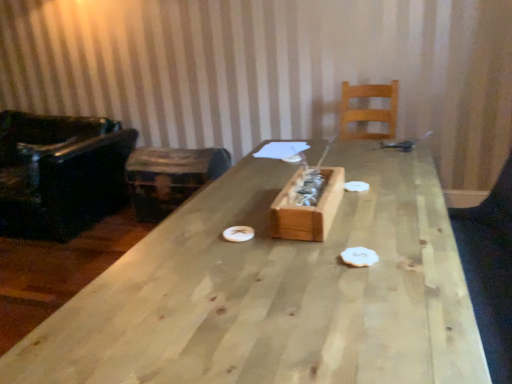
Question: From the image's perspective, is white matte paper plate at center, acting as the second paper plate starting from the left, on light wood chair at upper right, which is counted as the 1th chair, starting from the right?

Choices:
 (A) yes
 (B) no

Answer: (B)

Question: Is white matte paper plate at center, which ranks as the 1th paper plate in back-to-front order, further to the viewer compared to light wood chair at upper right, the second chair positioned from the left?

Choices:
 (A) yes
 (B) no

Answer: (B)

Question: Is white matte paper plate at center, marked as the first paper plate in a top-to-bottom arrangement, to the left of light wood chair at upper right, which is counted as the 1th chair, starting from the right, from the viewer's perspective?

Choices:
 (A) yes
 (B) no

Answer: (A)

Question: Does white matte paper plate at center, marked as the first paper plate in a top-to-bottom arrangement, have a lesser height compared to light wood chair at upper right, which is counted as the 1th chair, starting from the right?

Choices:
 (A) yes
 (B) no

Answer: (A)

Question: From a real-world perspective, is white matte paper plate at center, acting as the second paper plate starting from the left, over light wood chair at upper right, which is counted as the 1th chair, starting from the right?

Choices:
 (A) no
 (B) yes

Answer: (A)

Question: Is white matte paper plate at center, which ranks as the 1th paper plate in back-to-front order, far from light wood chair at upper right, the second chair positioned from the left?

Choices:
 (A) yes
 (B) no

Answer: (A)

Question: From a real-world perspective, is white matte paper plate at center, the 1th paper plate when ordered from left to right, positioned under wooden trunk at left based on gravity?

Choices:
 (A) yes
 (B) no

Answer: (B)

Question: Does white matte paper plate at center, the 1th paper plate when ordered from left to right, turn towards wooden trunk at left?

Choices:
 (A) no
 (B) yes

Answer: (A)

Question: Is white matte paper plate at center, the 2th paper plate when ordered from back to front, thinner than wooden trunk at left?

Choices:
 (A) no
 (B) yes

Answer: (B)

Question: Does white matte paper plate at center, which is counted as the 2th paper plate, starting from the top, have a lesser height compared to wooden trunk at left?

Choices:
 (A) no
 (B) yes

Answer: (B)

Question: Considering the relative sizes of white matte paper plate at center, which is counted as the 2th paper plate, starting from the top, and wooden trunk at left in the image provided, is white matte paper plate at center, which is counted as the 2th paper plate, starting from the top, taller than wooden trunk at left?

Choices:
 (A) yes
 (B) no

Answer: (B)

Question: Is wooden trunk at left at the back of white matte paper plate at center, the 1th paper plate from the front?

Choices:
 (A) yes
 (B) no

Answer: (B)

Question: Is white matte paper plate at center, the 2th paper plate viewed from the front, further to the viewer compared to natural wood table at center?

Choices:
 (A) yes
 (B) no

Answer: (A)